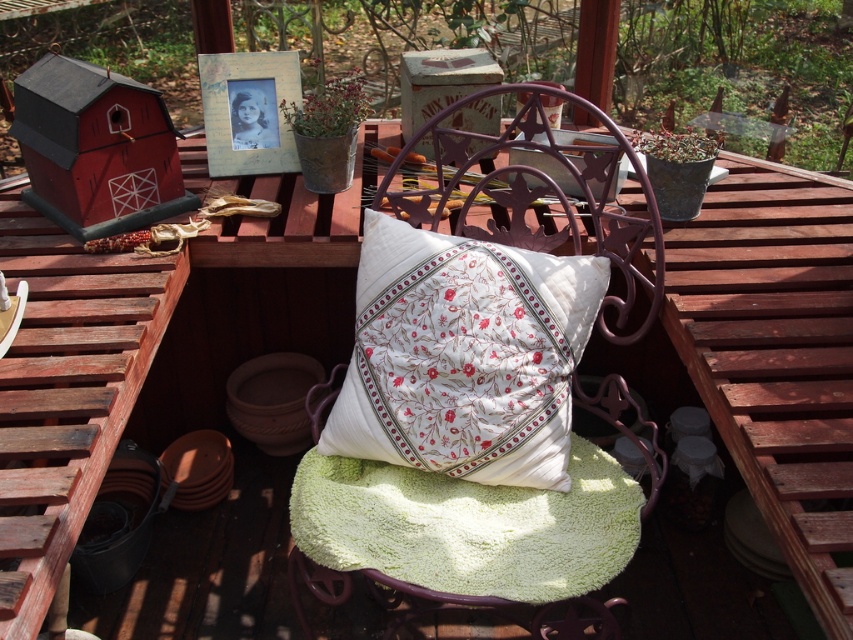
In the scene shown: Measure the distance between point (434, 253) and camera.

A distance of 4.24 feet exists between point (434, 253) and camera.

Describe the element at coordinates (463, 355) in the screenshot. I see `white cotton cushion at center` at that location.

This screenshot has height=640, width=853. Describe the element at coordinates (463, 355) in the screenshot. I see `white cotton cushion at center` at that location.

Locate an element on the screen. Image resolution: width=853 pixels, height=640 pixels. white cotton cushion at center is located at coordinates coord(463,355).

Can you confirm if white cotton cushion at center is bigger than green fluffy blanket at center?

Correct, white cotton cushion at center is larger in size than green fluffy blanket at center.

Who is positioned more to the left, white cotton cushion at center or green fluffy blanket at center?

From the viewer's perspective, white cotton cushion at center appears more on the left side.

You are a GUI agent. You are given a task and a screenshot of the screen. Output one action in this format:
    pyautogui.click(x=<x>, y=<y>)
    Task: Click on the white cotton cushion at center
    This screenshot has width=853, height=640.
    Given the screenshot: What is the action you would take?
    pyautogui.click(x=463, y=355)

Looking at this image, measure the distance between green fluffy blanket at center and white floral cushion at center.

The distance of green fluffy blanket at center from white floral cushion at center is 15.82 inches.

Can you confirm if green fluffy blanket at center is bigger than white floral cushion at center?

No.

Describe the element at coordinates (468, 525) in the screenshot. I see `green fluffy blanket at center` at that location.

At what (x,y) coordinates should I click in order to perform the action: click on green fluffy blanket at center. Please return your answer as a coordinate pair (x, y). Looking at the image, I should click on (468, 525).